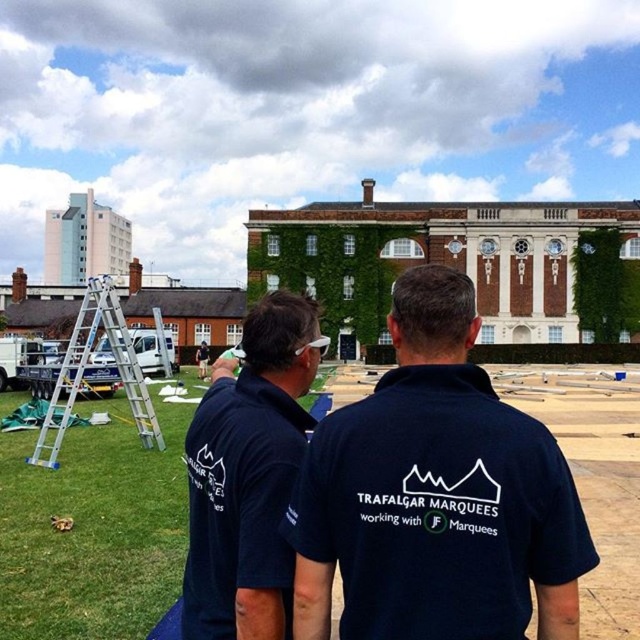
You are standing at the point marked as point (456, 300). A tree is located 200 feet in front of you. Is the tree within your line of sight? Please explain your reasoning.

The point marked as point (456, 300) is 239.77 feet away from the viewer. Since the tree is only 200 feet in front of the point, it would be closer to the viewer than the point itself. Therefore, the tree would be within the viewer s line of sight as it is positioned between the viewer and the point.